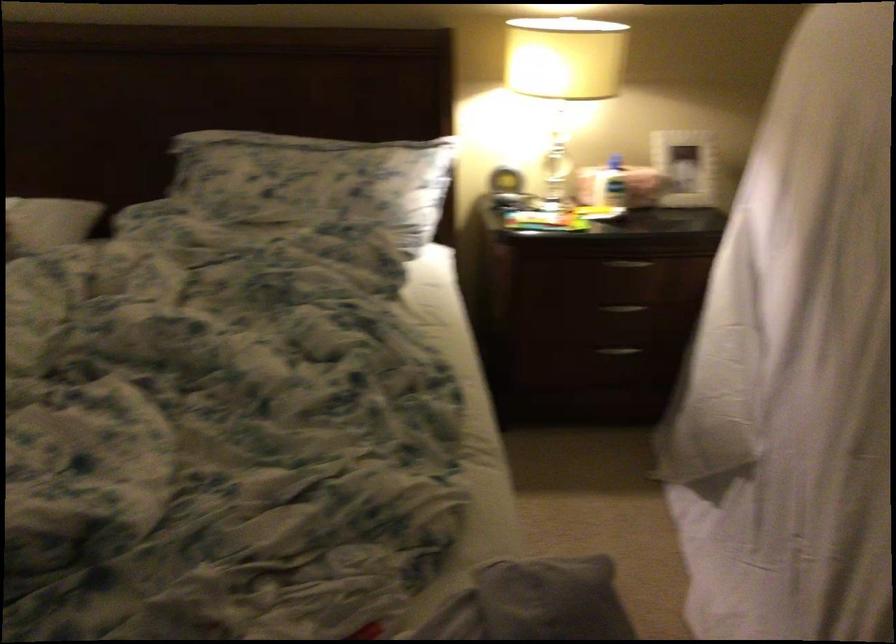
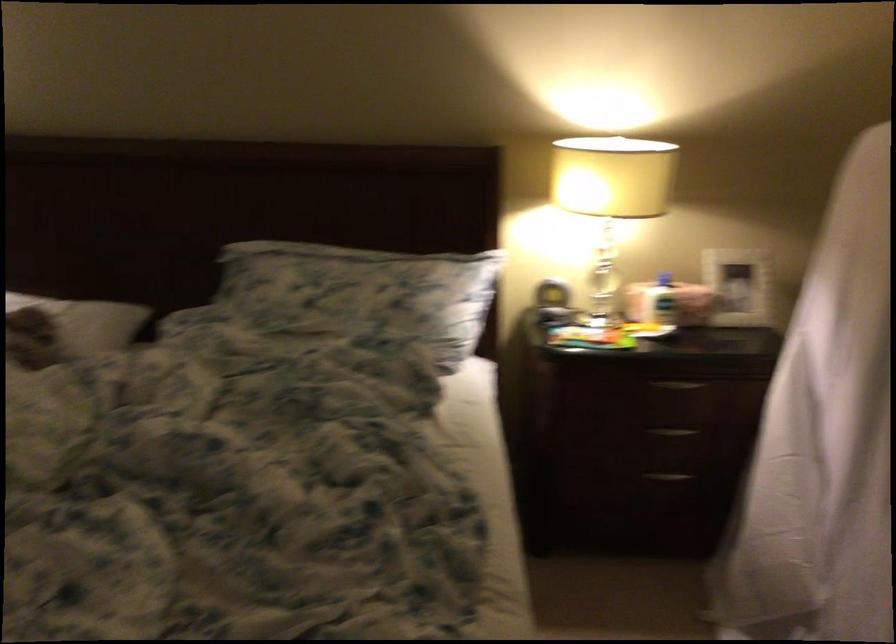
The point at (622, 307) is marked in the first image. Where is the corresponding point in the second image?

(672, 431)